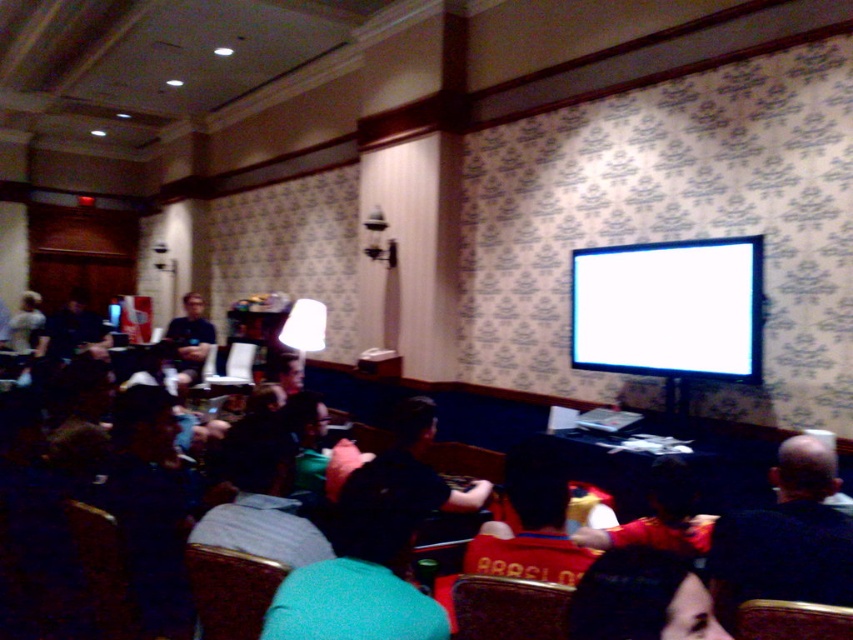
Question: Is white glossy monitor at upper right thinner than dark blue shirt at center?

Choices:
 (A) yes
 (B) no

Answer: (B)

Question: Which object appears closest to the camera in this image?

Choices:
 (A) dark green fabric at lower center
 (B) leather at center
 (C) teal fabric shirt at center
 (D) dark blue shirt at center

Answer: (A)

Question: Which of the following is the farthest from the observer?

Choices:
 (A) (476, 588)
 (B) (541, 461)
 (C) (392, 516)
 (D) (173, 332)

Answer: (D)

Question: Is brown leather chair at lower right thinner than matte black shirt at center?

Choices:
 (A) no
 (B) yes

Answer: (B)

Question: Which of the following is the farthest from the observer?

Choices:
 (A) brown leather chair at lower right
 (B) white glossy monitor at upper right
 (C) velvet-like brown chair at lower center
 (D) teal fabric shirt at center

Answer: (B)

Question: Does white glossy monitor at upper right appear under dark blue shirt at center?

Choices:
 (A) yes
 (B) no

Answer: (B)